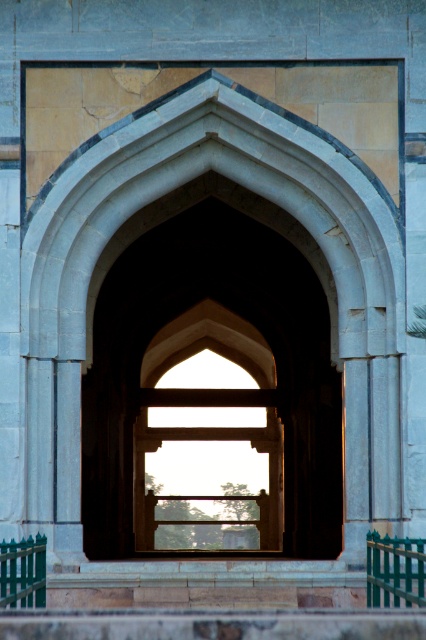
You are standing in front of the arches and want to know which of the two points, point (310,339) or point (402,547), is closer to you. Which one is closer?

Point (402,547) is closer to you because it is less further to the camera than point (310,339).

You are an architect designing a new historical building and want to replicate the distance between the smooth stone arch at center and the green painted wood at lower left in your design. What is the exact distance you should maintain between these two elements?

The exact distance you should maintain between the smooth stone arch at center and the green painted wood at lower left is 116.80 feet.

You are standing at the entrance of the archway and want to walk towards the green painted wood at lower left. Which direction should you turn to avoid the green painted metal railing at lower right?

You should turn to the left to avoid the green painted metal railing at lower right, as it is located to the right of the green painted wood at lower left.